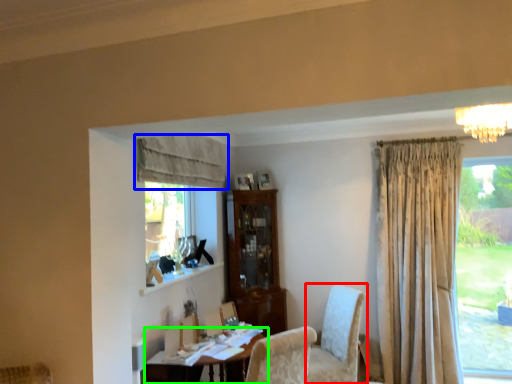
Question: Considering the real-world distances, which object is farthest from chair (highlighted by a red box)? curtain (highlighted by a blue box) or table (highlighted by a green box)?

Choices:
 (A) curtain
 (B) table

Answer: (A)